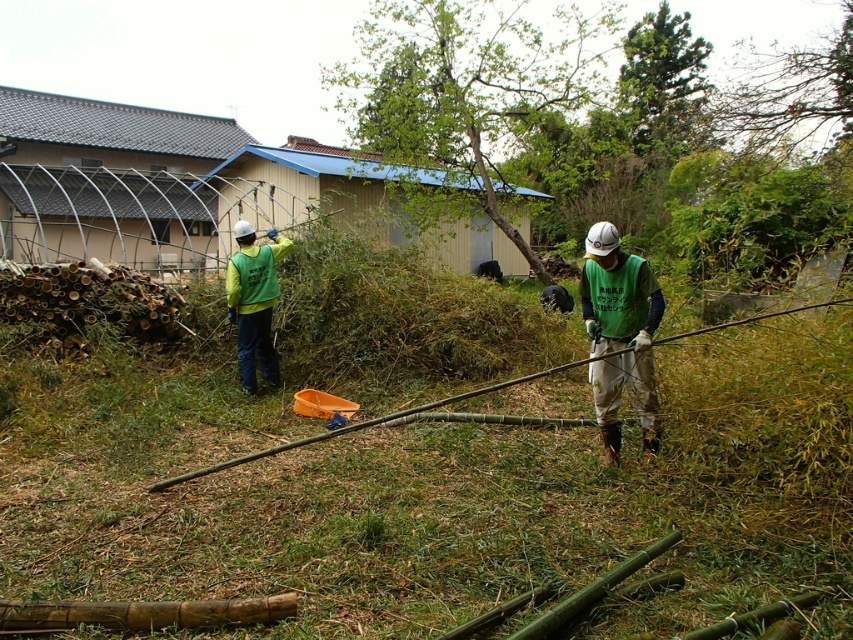
You are a safety inspector observing the outdoor scene. You notice the green fabric vest at center and the brown textured tree at upper right. Which object is shorter in height?

The green fabric vest at center has a lesser height compared to the brown textured tree at upper right, so the green fabric vest at center is shorter.